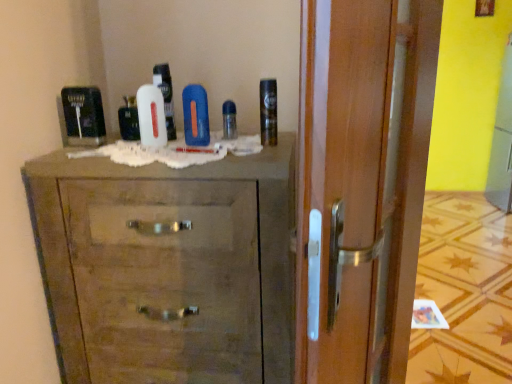
Find the location of a particular element. vacant area that is situated to the right of white matte shaving cream at center, acting as the third shaving cream starting from the right is located at coordinates (201, 147).